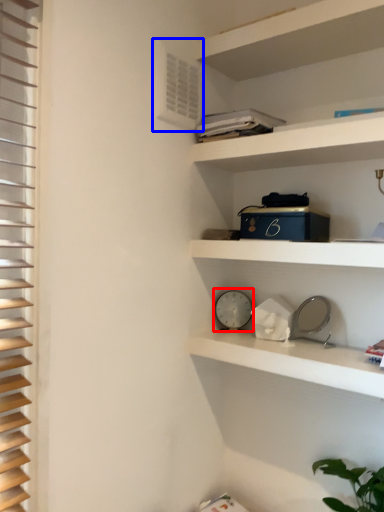
Question: Which point is closer to the camera, clock (highlighted by a red box) or air conditioning (highlighted by a blue box)?

Choices:
 (A) clock
 (B) air conditioning

Answer: (B)